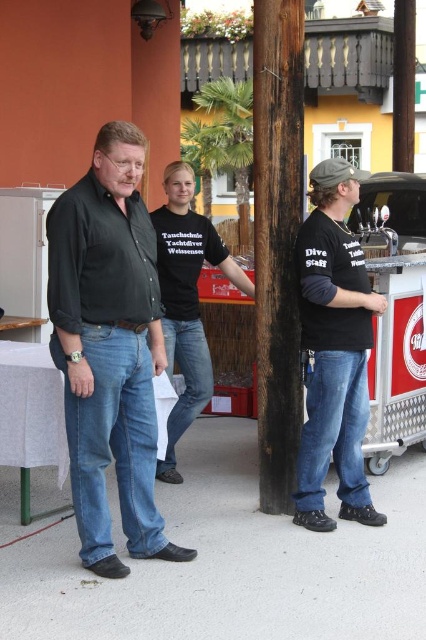
Is dark brown wood pole at center taller than matte black t-shirt at right?

Correct, dark brown wood pole at center is much taller as matte black t-shirt at right.

Does dark brown wood pole at center come in front of matte black t-shirt at right?

No.

This screenshot has height=640, width=426. What do you see at coordinates (276, 240) in the screenshot?
I see `dark brown wood pole at center` at bounding box center [276, 240].

I want to click on dark brown wood pole at center, so click(276, 240).

Can you confirm if dark brown wood pole at center is thinner than black cotton t-shirt at center?

Indeed, dark brown wood pole at center has a lesser width compared to black cotton t-shirt at center.

Looking at this image, which of these two, dark brown wood pole at center or black cotton t-shirt at center, stands shorter?

With less height is black cotton t-shirt at center.

Is point (281, 492) closer to camera compared to point (169, 348)?

Yes, point (281, 492) is closer to viewer.

At what (x,y) coordinates should I click in order to perform the action: click on dark brown wood pole at center. Please return your answer as a coordinate pair (x, y). The image size is (426, 640). Looking at the image, I should click on (276, 240).

Who is more forward, (336, 417) or (169, 436)?

Point (336, 417)

Find the location of a particular element. Image resolution: width=426 pixels, height=640 pixels. matte black t-shirt at right is located at coordinates (333, 349).